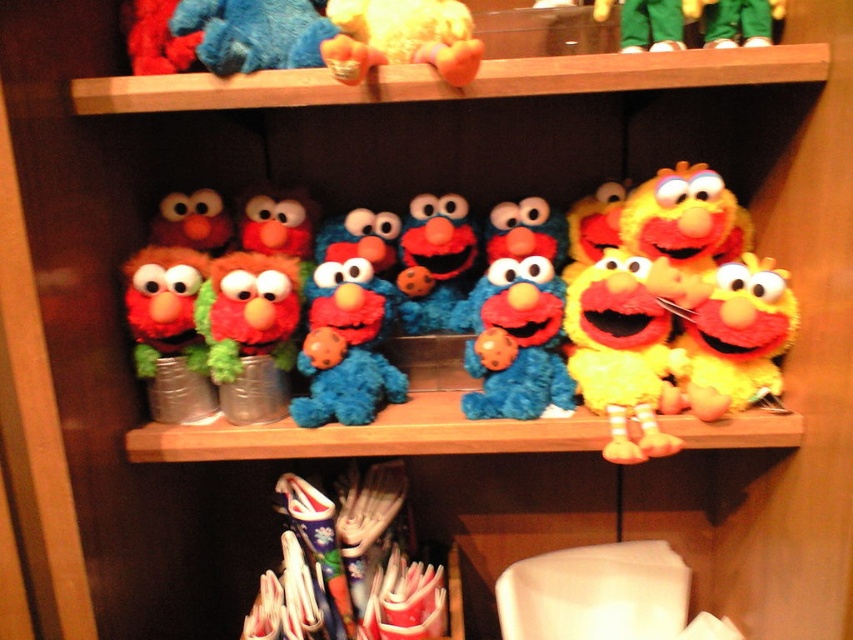
You are organizing a childrens toy store and need to place a new blue plush toy between the yellow plush toy at right and the velvet plush toy at center. Can you do this based on their current positions?

The yellow plush toy at right is to the right of the velvet plush toy at center, so placing a new blue plush toy between them would require positioning it between the two existing toys.

You are organizing a toy store and need to place the velvet plush toy at center and the blue plush toy at upper center on a shelf. Considering their sizes, which one should you place first to ensure they both fit?

The velvet plush toy at center occupies less space than the blue plush toy at upper center, so you should place the blue plush toy at upper center first to ensure both fit on the shelf.

You are a child trying to reach the yellow plush toy at right and the velvet plush toy at center on the shelf. Which one can you grab first without moving the other?

The yellow plush toy at right is in front of the velvet plush toy at center, so you can grab the yellow plush toy at right first without moving the other.